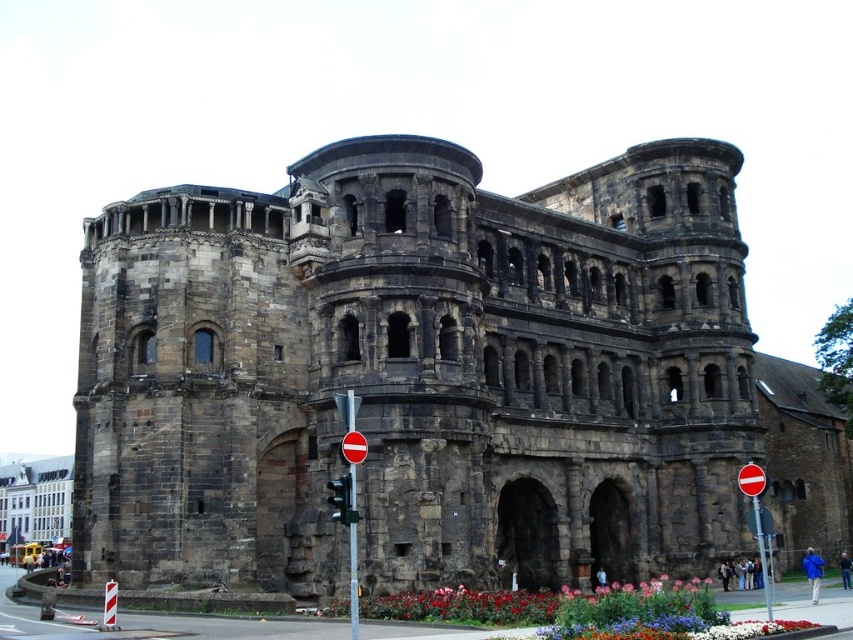
You are standing in front of the rustic stone building at center. If you want to take a photo of it with your smartphone, which has a maximum focus range of 50 meters, will you be able to capture the entire building in focus?

The rustic stone building at center is 51.49 meters away from the viewer. Since the smartphone has a maximum focus range of 50 meters, you will not be able to capture the entire building in focus.

You are standing in front of the rustic stone building at center and want to take a photo that captures the entire structure. Considering the building is 51.49 meters away from you, what is the minimum focal length lens you should use if your camera has a sensor size of 36mm x 24mm and you want to frame the building within the 60 degree horizontal field of view?

To capture the entire rustic stone building at center within a 60 degree horizontal field of view, you need a lens with a focal length of approximately 36mm. This calculation is based on the formula focal length equals sensor width divided by two times the tangent of half the field of view angle. Using 36mm sensor width and 60 degrees, the formula gives 36mm divided by 2 times tan 30 degrees, resulting in roughly 36mm divided by 1.1547 equals approximately 31.2mm. However, since the building is 51.49 meters